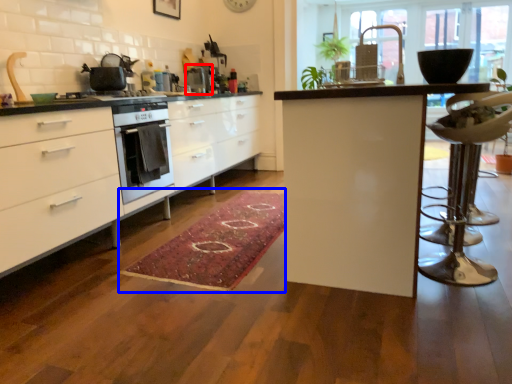
Question: Which point is further to the camera, appliance (highlighted by a red box) or doormat (highlighted by a blue box)?

Choices:
 (A) appliance
 (B) doormat

Answer: (A)